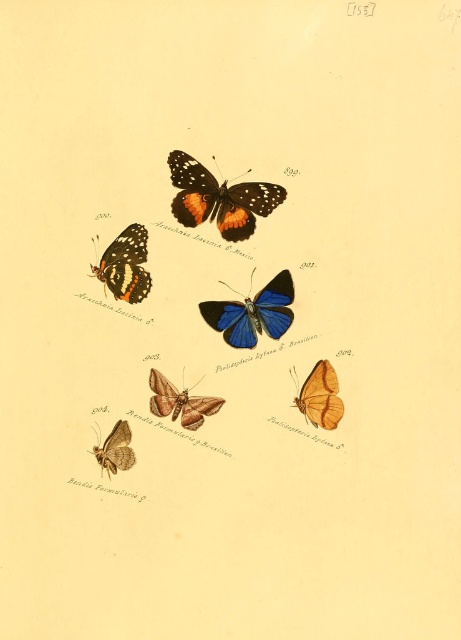
You are an entomologist examining the vintage butterfly illustration. You need to determine which butterfly has a larger wingspan between the blue glossy butterfly at center and the orange and black butterfly at upper left. Which one should you choose?

The blue glossy butterfly at center is larger in size than the orange and black butterfly at upper left, so you should choose the blue glossy butterfly at center.

You are an entomologist examining this vintage butterfly illustration. You need to determine which butterfly has a larger width between the blue glossy butterfly at center and the orange and black butterfly at upper left. Based on the illustration, which one is wider?

The blue glossy butterfly at center is wider than the orange and black butterfly at upper left, as stated in the description.

You are an entomologist examining the vintage butterfly illustration. You notice two butterflies labeled as the orange and black butterfly at center and the orange matte butterfly at center. Which one is positioned higher in the image?

The orange and black butterfly at center is positioned higher because it is above the orange matte butterfly at center.